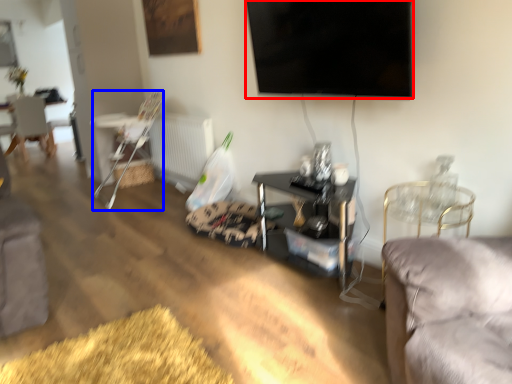
Question: Which point is closer to the camera, television (highlighted by a red box) or chair (highlighted by a blue box)?

Choices:
 (A) television
 (B) chair

Answer: (A)